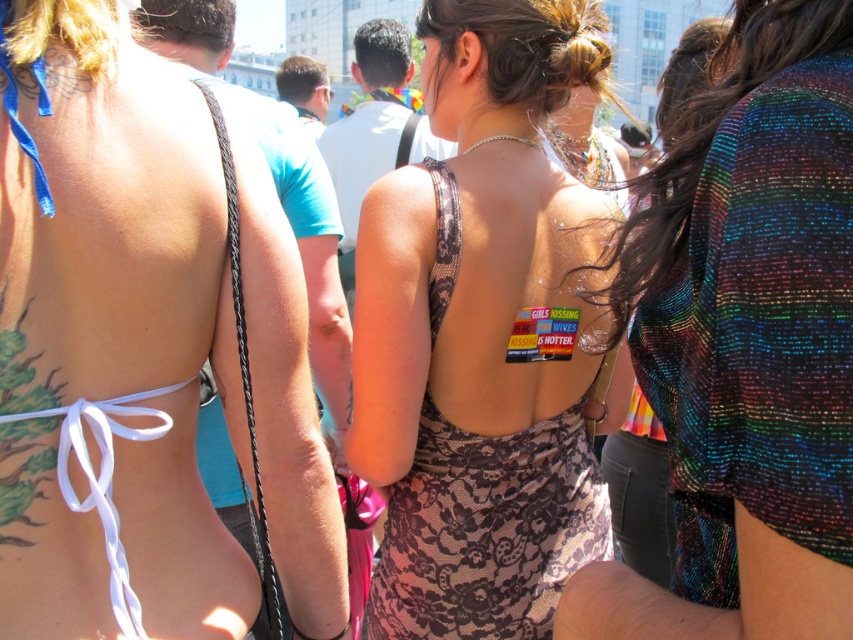
Question: Among these objects, which one is nearest to the camera?

Choices:
 (A) brown lace dress at center
 (B) matte black bikini top at center
 (C) rainbow sequined dress at center

Answer: (C)

Question: Is matte black bikini top at center positioned in front of brown lace dress at center?

Choices:
 (A) no
 (B) yes

Answer: (B)

Question: Can you confirm if brown lace dress at center is positioned above rainbow sequined dress at center?

Choices:
 (A) no
 (B) yes

Answer: (B)

Question: Can you confirm if matte black bikini top at center is wider than rainbow sequined dress at center?

Choices:
 (A) no
 (B) yes

Answer: (B)

Question: Which point is farther to the camera?

Choices:
 (A) matte black bikini top at center
 (B) brown lace dress at center
 (C) rainbow sequined dress at center

Answer: (B)

Question: Estimate the real-world distances between objects in this image. Which object is farther from the rainbow sequined dress at center?

Choices:
 (A) matte black bikini top at center
 (B) brown lace dress at center

Answer: (B)